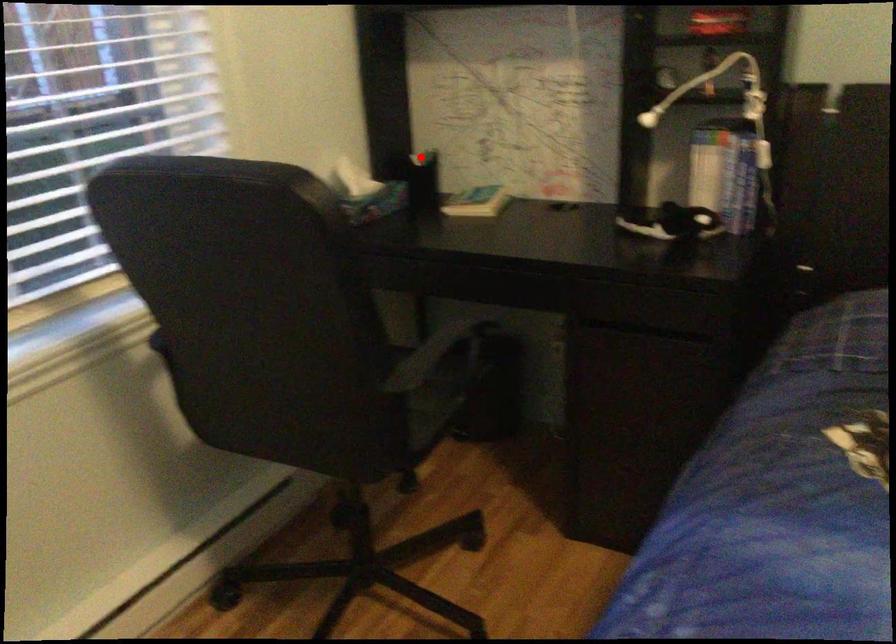
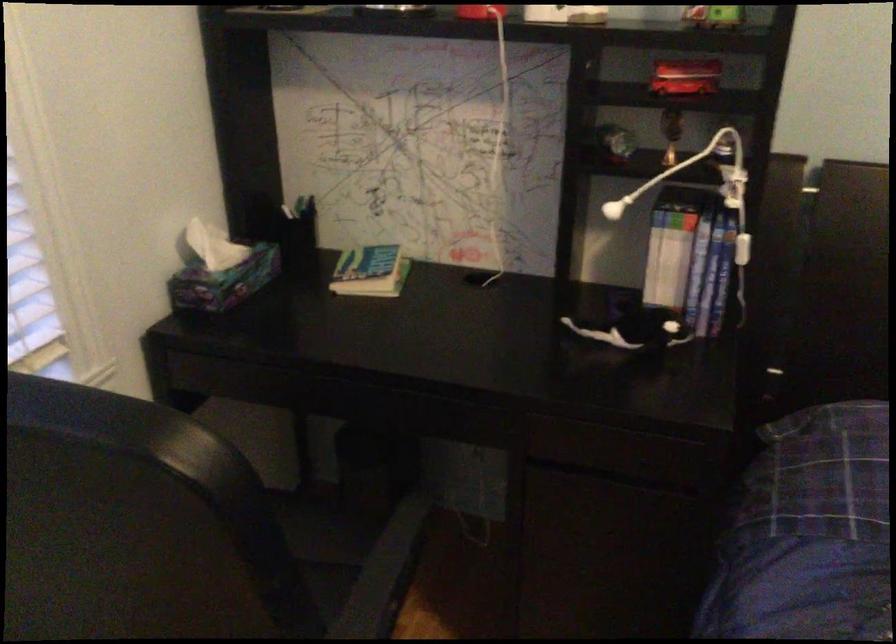
Locate, in the second image, the point that corresponds to the highlighted location in the first image.

(295, 211)